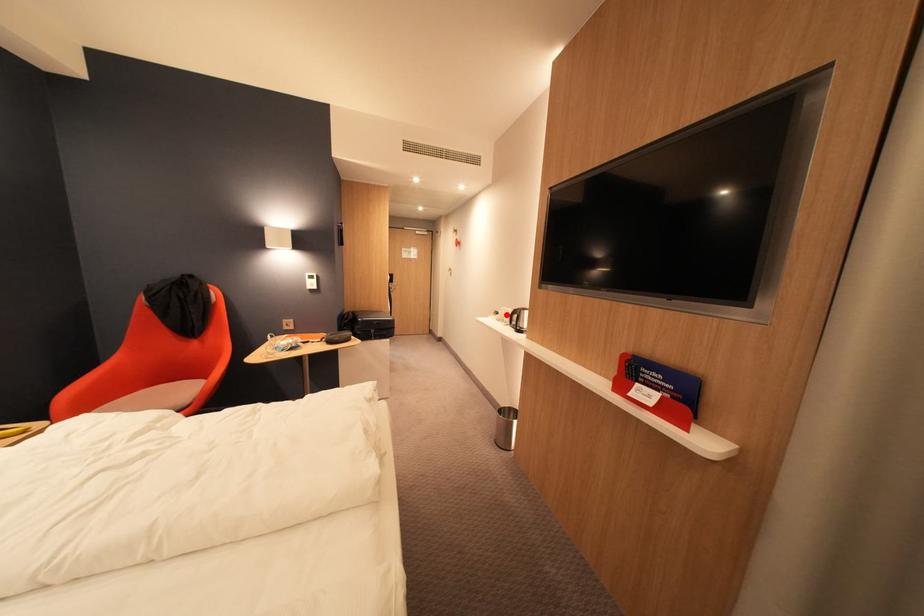
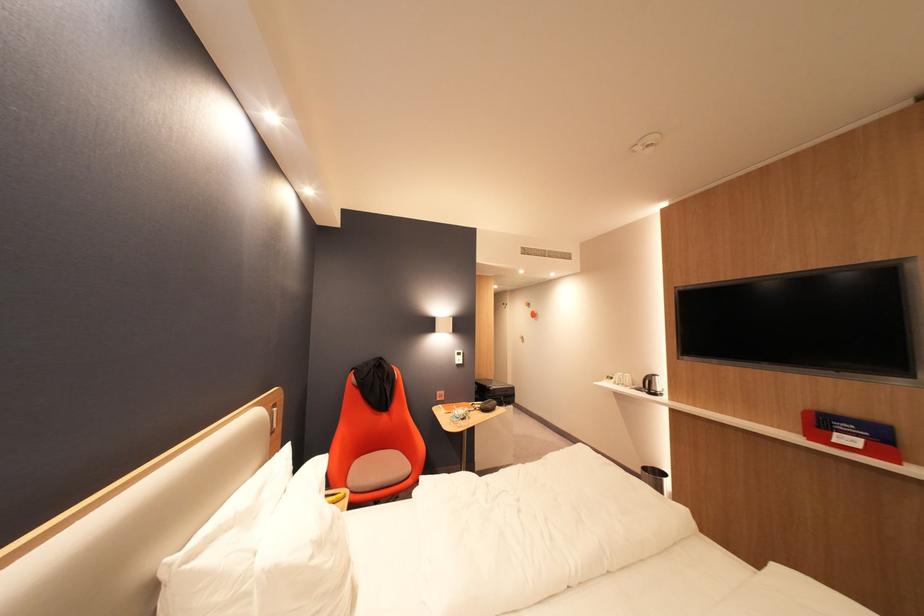
In the second image, find the point that corresponds to the highlighted location in the first image.

(622, 379)